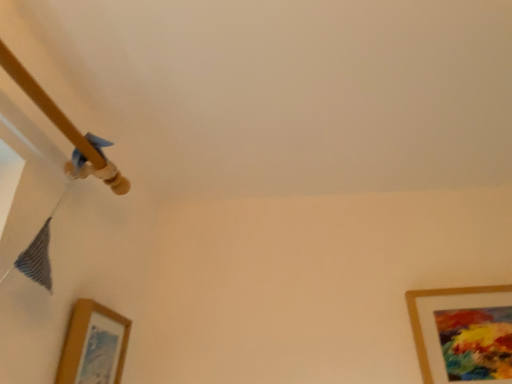
Question: From the image's perspective, is gold matte picture frame at lower right, which appears as the 2th picture frame when viewed from the left, located above or below wooden picture frame at lower left, the 1th picture frame in the left-to-right sequence?

Choices:
 (A) above
 (B) below

Answer: (B)

Question: Looking at the image, does gold matte picture frame at lower right, which appears as the first picture frame when viewed from the right, seem bigger or smaller compared to wooden picture frame at lower left, arranged as the second picture frame when viewed from the right?

Choices:
 (A) big
 (B) small

Answer: (A)

Question: Considering the positions of point (457, 352) and point (108, 352), is point (457, 352) closer or farther from the camera than point (108, 352)?

Choices:
 (A) farther
 (B) closer

Answer: (A)

Question: From the image's perspective, is wooden picture frame at lower left, arranged as the second picture frame when viewed from the right, located above or below gold matte picture frame at lower right, which appears as the 2th picture frame when viewed from the left?

Choices:
 (A) below
 (B) above

Answer: (B)

Question: Based on their sizes in the image, would you say wooden picture frame at lower left, arranged as the second picture frame when viewed from the right, is bigger or smaller than gold matte picture frame at lower right, which appears as the 2th picture frame when viewed from the left?

Choices:
 (A) big
 (B) small

Answer: (B)

Question: Is point (124, 324) closer or farther from the camera than point (498, 304)?

Choices:
 (A) farther
 (B) closer

Answer: (B)

Question: Visually, is wooden picture frame at lower left, the 1th picture frame in the left-to-right sequence, positioned to the left or to the right of gold matte picture frame at lower right, which appears as the 2th picture frame when viewed from the left?

Choices:
 (A) right
 (B) left

Answer: (B)